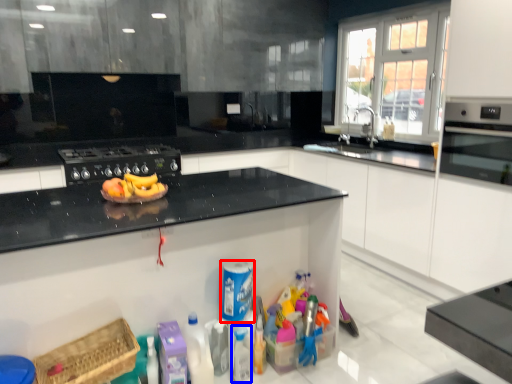
Question: Among these objects, which one is nearest to the camera, cleaning product (highlighted by a red box) or bottle (highlighted by a blue box)?

Choices:
 (A) cleaning product
 (B) bottle

Answer: (A)